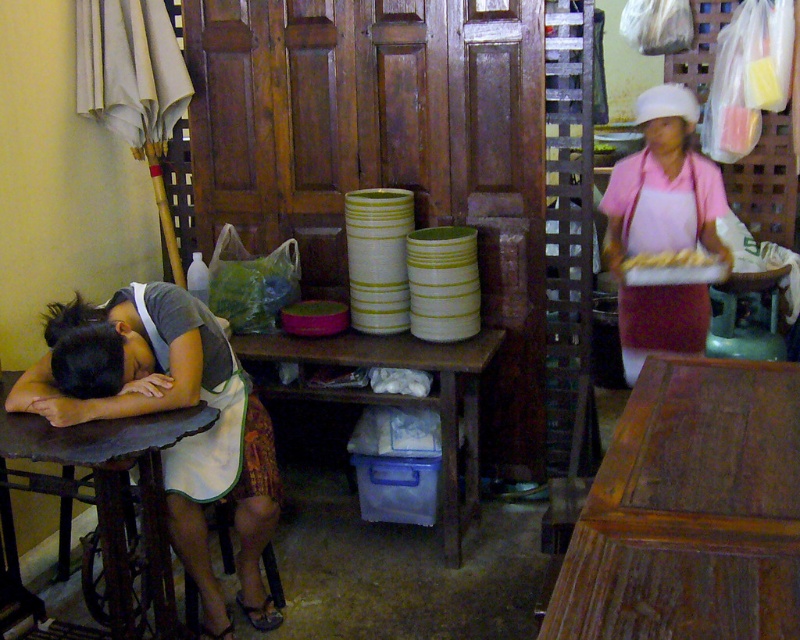
Question: Which object is farther from the camera taking this photo?

Choices:
 (A) pink fabric apron at right
 (B) wooden table at lower right
 (C) golden crispy bread at center
 (D) rustic wood table at lower left

Answer: (A)

Question: Is pink fabric apron at right above wooden table at center?

Choices:
 (A) yes
 (B) no

Answer: (A)

Question: Does wooden table at lower right have a smaller size compared to rustic wood table at lower left?

Choices:
 (A) yes
 (B) no

Answer: (B)

Question: Considering the real-world distances, which object is farthest from the golden crispy bread at center?

Choices:
 (A) wooden table at center
 (B) pink fabric apron at right
 (C) rustic wood table at lower left

Answer: (C)

Question: Which object is farther from the camera taking this photo?

Choices:
 (A) pink fabric apron at right
 (B) wooden table at lower right
 (C) golden crispy bread at center
 (D) wooden table at center

Answer: (A)

Question: In this image, where is wooden table at lower right located relative to wooden table at center?

Choices:
 (A) above
 (B) below

Answer: (B)